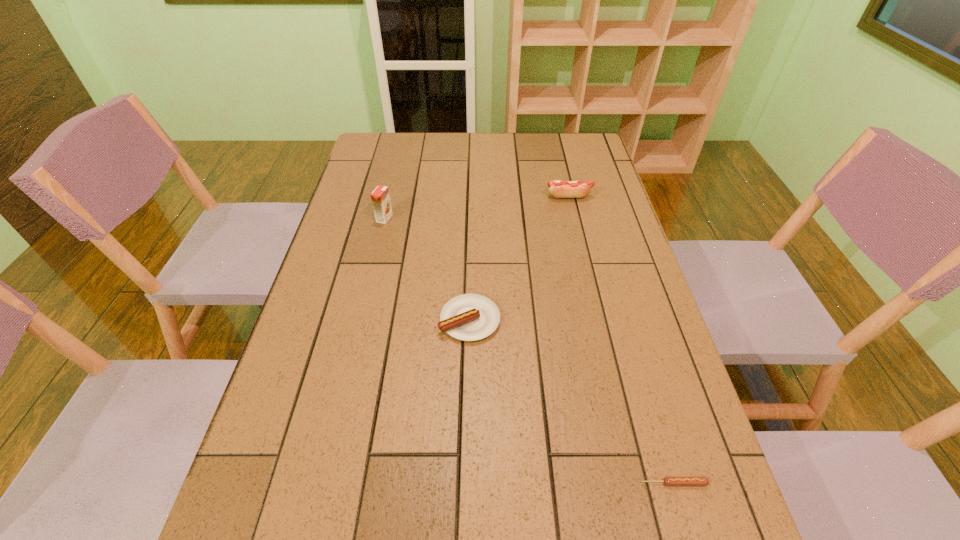
Identify which sausage is the second closest to the leftmost sausage. Please provide its 2D coordinates. Your answer should be formatted as a tuple, i.e. [(x, y)], where the tuple contains the x and y coordinates of a point satisfying the conditions above.

[(560, 189)]

This screenshot has width=960, height=540. Identify the location of sausage that is the third closest to the tallest object. (668, 481).

Image resolution: width=960 pixels, height=540 pixels. Identify the location of free space in the image that satisfies the following two spatial constraints: 1. on the front side of the nearest sausage; 2. on the left side of the tallest object. (321, 483).

Image resolution: width=960 pixels, height=540 pixels. In order to click on vacant position in the image that satisfies the following two spatial constraints: 1. on the front side of the second shortest object; 2. on the left side of the orange juice in this screenshot , I will do `click(360, 320)`.